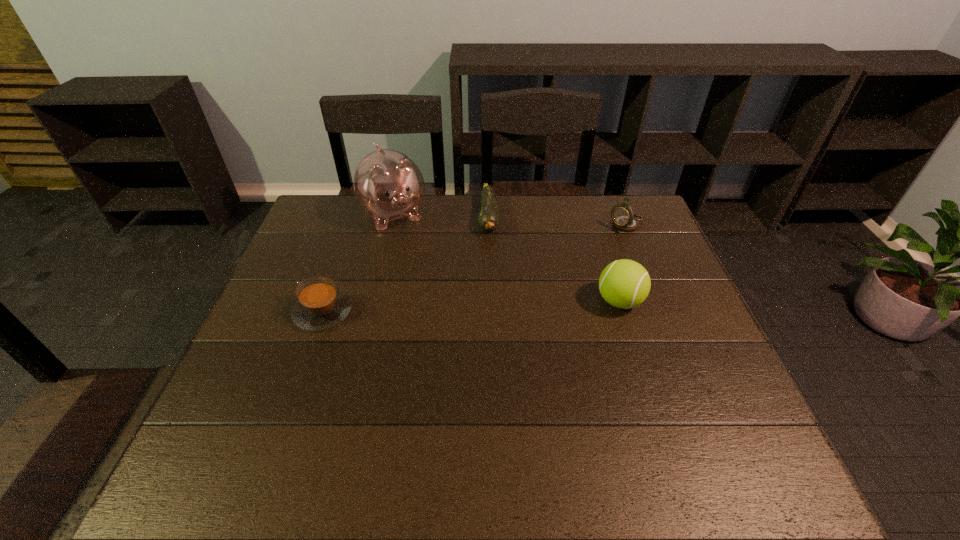
Locate an element on the screen. cappuccino is located at coordinates (320, 305).

Find the location of a particular element. The width and height of the screenshot is (960, 540). tennis ball is located at coordinates (624, 284).

Where is `compass`? compass is located at coordinates (624, 219).

Identify the location of the shortest object. (488, 219).

Image resolution: width=960 pixels, height=540 pixels. In order to click on the third object from right to left in this screenshot , I will do `click(488, 219)`.

Identify the location of the tallest object. tap(389, 186).

Identify the location of vacant region located on the right of the second shortest object. The height and width of the screenshot is (540, 960). (425, 312).

I want to click on free region located 0.290m on the back of the tennis ball, so click(594, 222).

Locate an element on the screen. The height and width of the screenshot is (540, 960). vacant space located on the face of the compass is located at coordinates (528, 288).

Where is `free space located 0.110m on the face of the compass`? This screenshot has width=960, height=540. free space located 0.110m on the face of the compass is located at coordinates (592, 246).